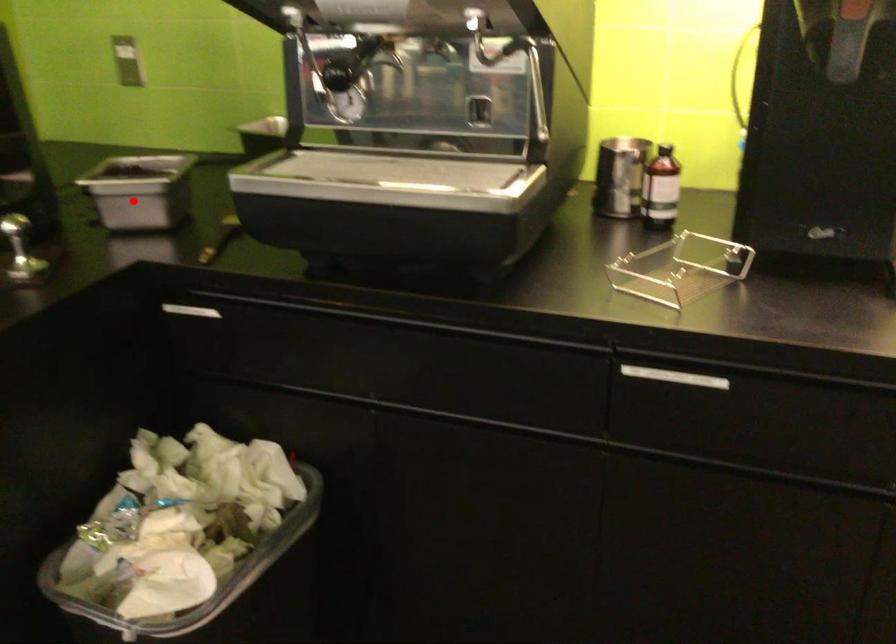
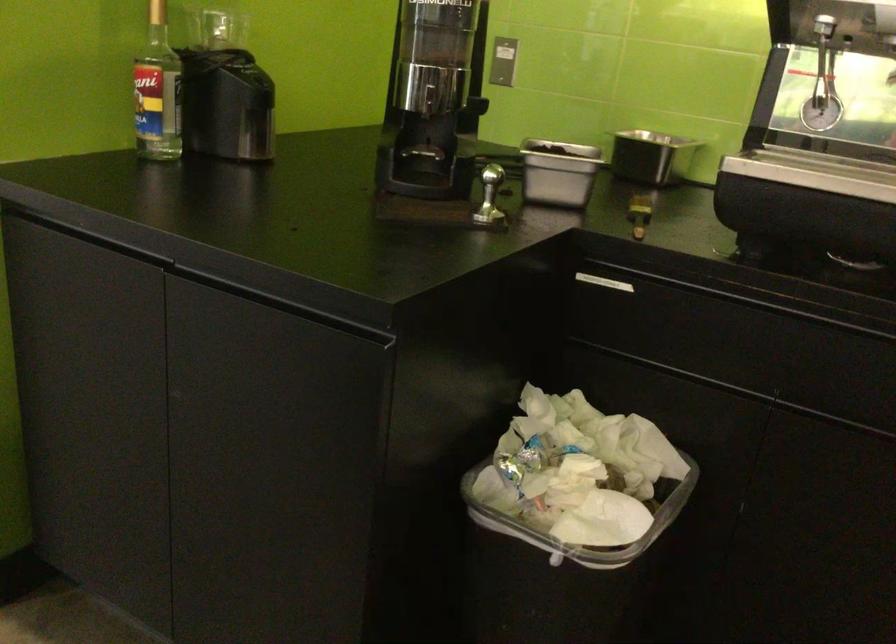
Locate, in the second image, the point that corresponds to the highlighted location in the first image.

(558, 172)